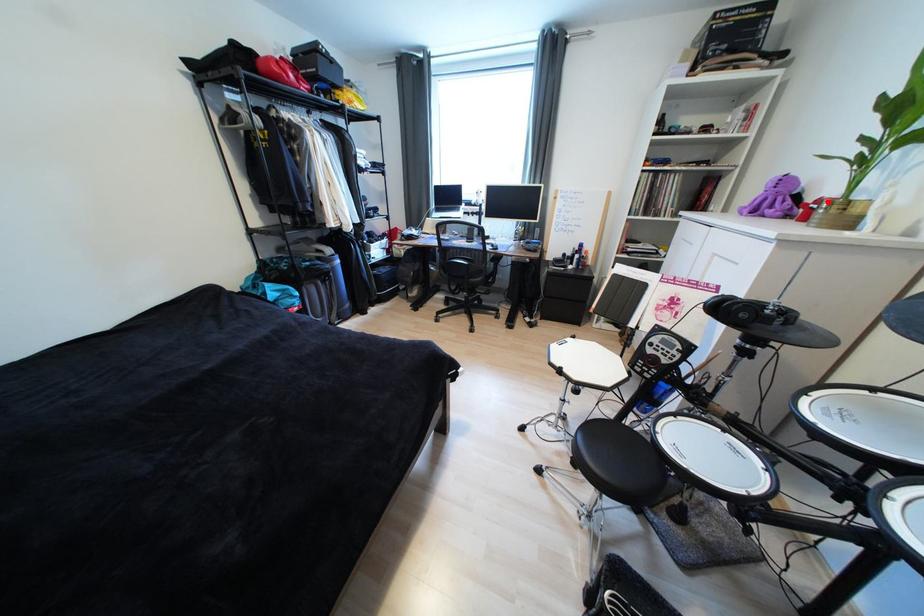
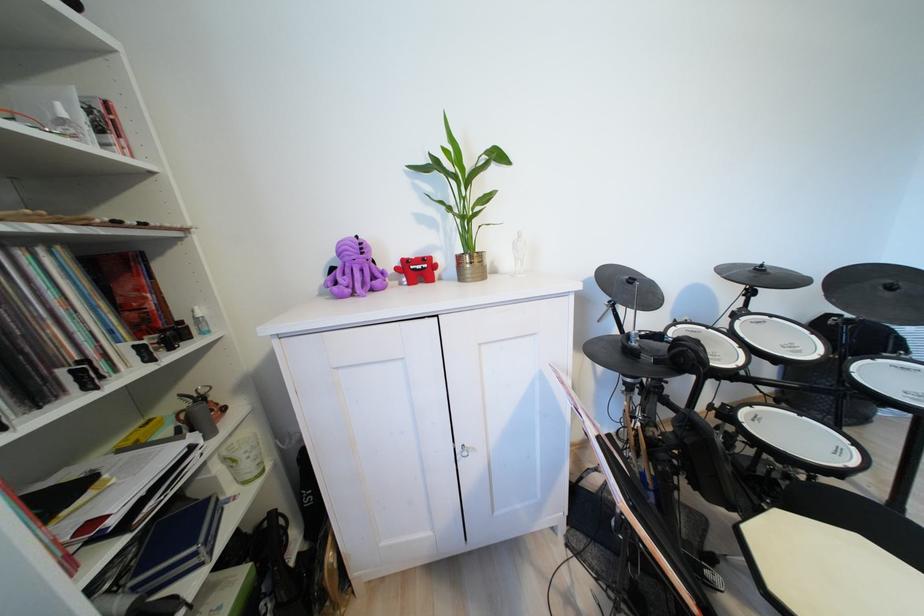
Question: I am providing you with two images of the same scene from different viewpoints. Image1 has a red point marked. In image2, the corresponding 3D location appears at what relative position? Reply with the corresponding letter.

Choices:
 (A) Closer
 (B) Farther

Answer: (A)